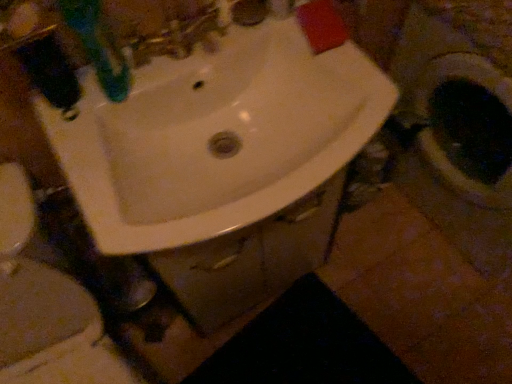
Question: Considering the relative positions of white glossy sink at center and green plastic toothbrush at upper left in the image provided, is white glossy sink at center to the right of green plastic toothbrush at upper left from the viewer's perspective?

Choices:
 (A) no
 (B) yes

Answer: (B)

Question: Is white glossy sink at center outside of green plastic toothbrush at upper left?

Choices:
 (A) yes
 (B) no

Answer: (A)

Question: Does white glossy sink at center come behind green plastic toothbrush at upper left?

Choices:
 (A) yes
 (B) no

Answer: (A)

Question: From the image's perspective, is white glossy sink at center under green plastic toothbrush at upper left?

Choices:
 (A) yes
 (B) no

Answer: (A)

Question: Does white glossy sink at center have a greater height compared to green plastic toothbrush at upper left?

Choices:
 (A) yes
 (B) no

Answer: (B)

Question: Do you think green plastic toothbrush at upper left is within white glossy toilet at center, or outside of it?

Choices:
 (A) inside
 (B) outside

Answer: (B)

Question: Considering the positions of point (78, 29) and point (45, 281), is point (78, 29) closer or farther from the camera than point (45, 281)?

Choices:
 (A) closer
 (B) farther

Answer: (A)

Question: In terms of height, does green plastic toothbrush at upper left look taller or shorter compared to white glossy toilet at center?

Choices:
 (A) short
 (B) tall

Answer: (A)

Question: Considering the positions of green plastic toothbrush at upper left and white glossy toilet at center in the image, is green plastic toothbrush at upper left bigger or smaller than white glossy toilet at center?

Choices:
 (A) big
 (B) small

Answer: (B)

Question: From their relative heights in the image, would you say white glossy sink at center is taller or shorter than white glossy toilet at center?

Choices:
 (A) short
 (B) tall

Answer: (A)

Question: Looking at the image, does white glossy sink at center seem bigger or smaller compared to white glossy toilet at center?

Choices:
 (A) small
 (B) big

Answer: (A)

Question: Considering their positions, is white glossy sink at center located in front of or behind white glossy toilet at center?

Choices:
 (A) behind
 (B) front

Answer: (A)

Question: Is point (231, 82) positioned closer to the camera than point (88, 375)?

Choices:
 (A) farther
 (B) closer

Answer: (B)

Question: Considering their positions, is green plastic toothbrush at upper left located in front of or behind black matte rug at lower center?

Choices:
 (A) behind
 (B) front

Answer: (B)

Question: Is point (109, 94) positioned closer to the camera than point (212, 380)?

Choices:
 (A) closer
 (B) farther

Answer: (A)